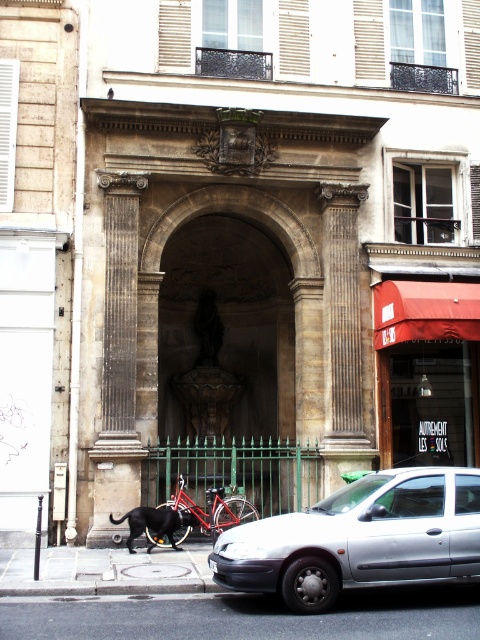
Can you confirm if red fabric awning at lower right is wider than black fur dog at lower left?

No, red fabric awning at lower right is not wider than black fur dog at lower left.

Does red fabric awning at lower right have a lesser width compared to black fur dog at lower left?

Correct, red fabric awning at lower right's width is less than black fur dog at lower left's.

Which is in front, point (469, 364) or point (157, 518)?

Positioned in front is point (157, 518).

You are a GUI agent. You are given a task and a screenshot of the screen. Output one action in this format:
    pyautogui.click(x=<x>, y=<y>)
    Task: Click on the red fabric awning at lower right
    The image size is (480, 640).
    Given the screenshot: What is the action you would take?
    pyautogui.click(x=427, y=371)

Which of these two, brown stone archway at center or shiny red bicycle at lower center, stands shorter?

shiny red bicycle at lower center is shorter.

Between brown stone archway at center and shiny red bicycle at lower center, which one appears on the left side from the viewer's perspective?

From the viewer's perspective, shiny red bicycle at lower center appears more on the left side.

Between point (167, 417) and point (191, 499), which one is positioned behind?

The point (167, 417) is behind.

Where is `brown stone archway at center`? This screenshot has width=480, height=640. brown stone archway at center is located at coordinates (228, 369).

Between silver metallic car at lower right and black fur dog at lower left, which one appears on the right side from the viewer's perspective?

silver metallic car at lower right is more to the right.

Measure the distance between silver metallic car at lower right and camera.

silver metallic car at lower right and camera are 41.37 feet apart.

At what (x,y) coordinates should I click in order to perform the action: click on silver metallic car at lower right. Please return your answer as a coordinate pair (x, y). Looking at the image, I should click on (360, 538).